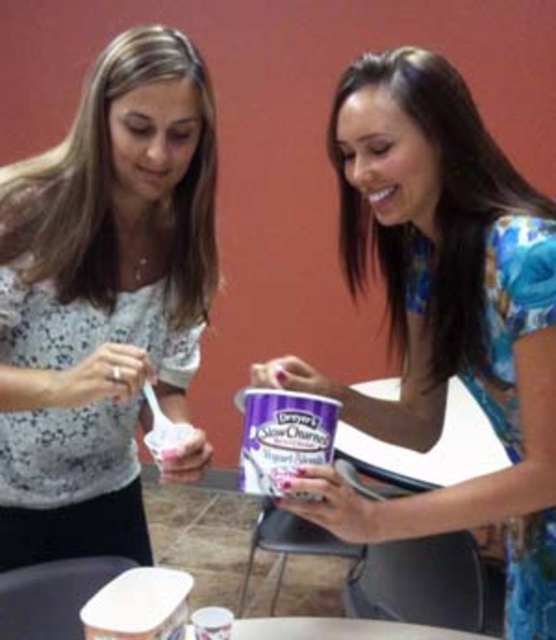
Question: Observing the image, what is the correct spatial positioning of white lace blouse at left in reference to floral dress at center?

Choices:
 (A) below
 (B) above

Answer: (B)

Question: Can you confirm if white lace blouse at left is thinner than floral dress at center?

Choices:
 (A) yes
 (B) no

Answer: (A)

Question: Among these points, which one is farthest from the camera?

Choices:
 (A) (23, 394)
 (B) (356, 532)

Answer: (A)

Question: Which object is closer to the camera taking this photo?

Choices:
 (A) white lace blouse at left
 (B) floral dress at center

Answer: (B)

Question: Is white lace blouse at left further to camera compared to floral dress at center?

Choices:
 (A) yes
 (B) no

Answer: (A)